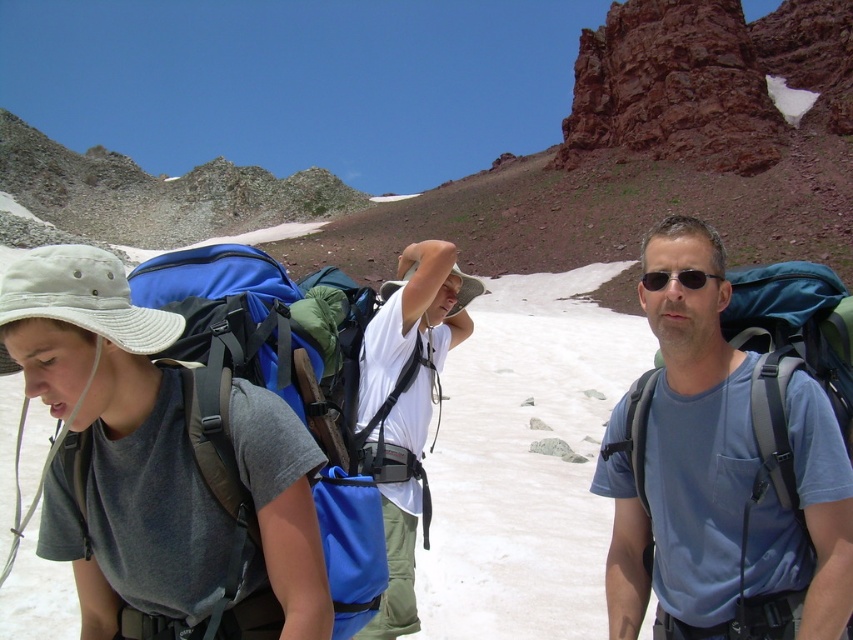
Question: Does blue fabric backpack at left appear on the left side of black plastic sunglasses at center?

Choices:
 (A) no
 (B) yes

Answer: (B)

Question: Which object appears closest to the camera in this image?

Choices:
 (A) black plastic sunglasses at center
 (B) blue fabric backpack at left

Answer: (B)

Question: Among these objects, which one is farthest from the camera?

Choices:
 (A) black plastic sunglasses at center
 (B) blue fabric backpack at center-right
 (C) blue fabric backpack at left

Answer: (A)

Question: Where is blue fabric backpack at center-right located in relation to blue fabric backpack at left in the image?

Choices:
 (A) below
 (B) above

Answer: (B)

Question: Is blue fabric backpack at center-right to the right of blue fabric backpack at left from the viewer's perspective?

Choices:
 (A) yes
 (B) no

Answer: (A)

Question: Among these points, which one is nearest to the camera?

Choices:
 (A) (740, 502)
 (B) (693, 268)
 (C) (79, 516)

Answer: (C)